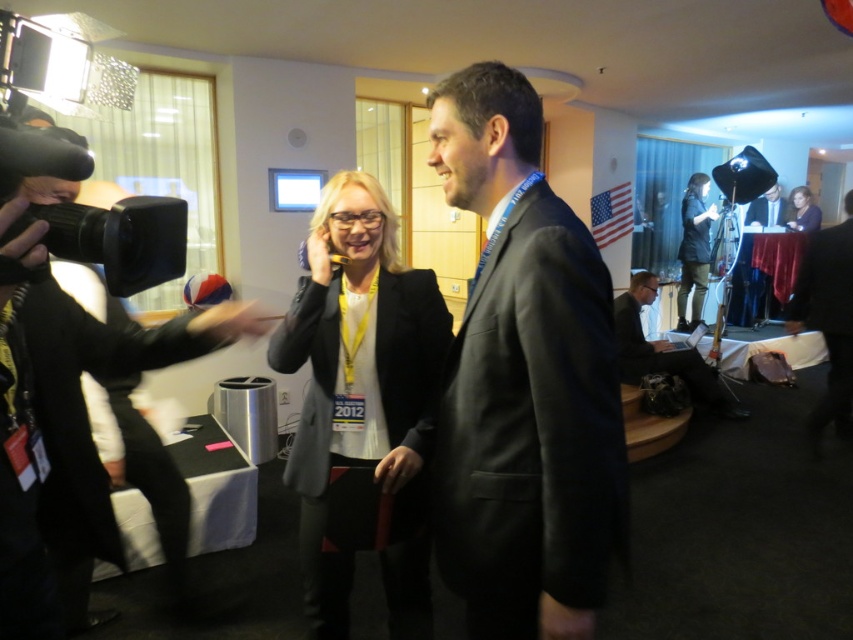
You are a photographer at the event and need to capture a closeup of both the dark gray wool coat at center and the matte black jacket at upper right. Which one would you need to get closer to in order to frame them properly?

The dark gray wool coat at center is larger in size compared to the matte black jacket at upper right, so you would need to get closer to the matte black jacket at upper right to frame it properly.

You are attending a press conference and need to present a document from your laptop. The black matte suit at left is blocking your view of the matte black laptop at lower right. Can you easily access the laptop without moving the suit?

The black matte suit at left is positioned under the matte black laptop at lower right, meaning the laptop is above the suit. Since the suit is below the laptop, you can access the laptop without needing to move the suit.